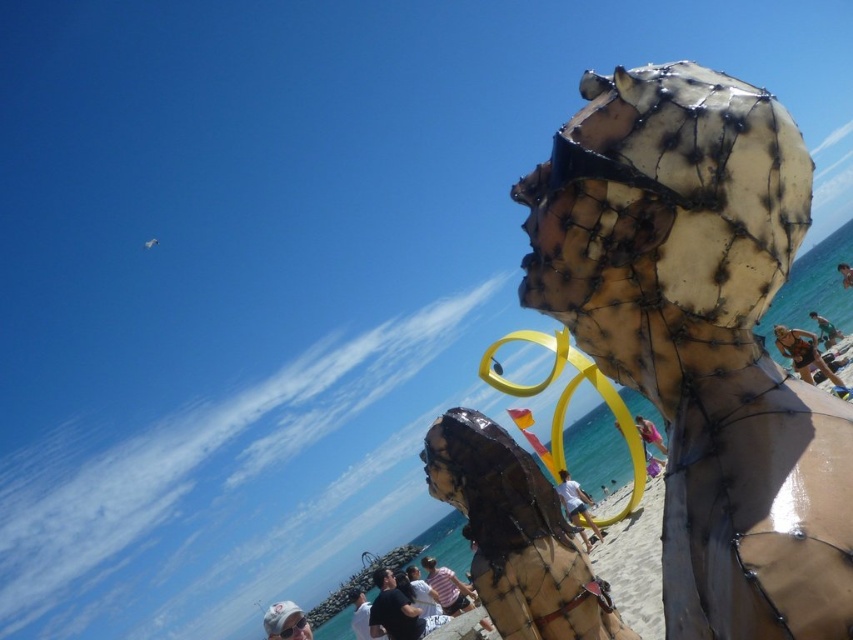
Which of these two, matte brown surfboard at center or white fabric shirt at lower center, stands shorter?

matte brown surfboard at center is shorter.

Is matte brown surfboard at center to the right of white fabric shirt at lower center from the viewer's perspective?

Indeed, matte brown surfboard at center is positioned on the right side of white fabric shirt at lower center.

Is point (572, 508) behind point (360, 627)?

That is True.

At what (x,y) coordinates should I click in order to perform the action: click on matte brown surfboard at center. Please return your answer as a coordinate pair (x, y). This screenshot has width=853, height=640. Looking at the image, I should click on (576, 506).

Can you confirm if matte black shirt at center is bigger than smooth brown skin at upper right?

No, matte black shirt at center is not bigger than smooth brown skin at upper right.

Locate an element on the screen. matte black shirt at center is located at coordinates (393, 611).

Image resolution: width=853 pixels, height=640 pixels. I want to click on matte black shirt at center, so click(x=393, y=611).

Is point (297, 621) closer to viewer compared to point (421, 634)?

Yes.

The image size is (853, 640). In order to click on white fabric cap at lower left in this screenshot , I will do `click(285, 621)`.